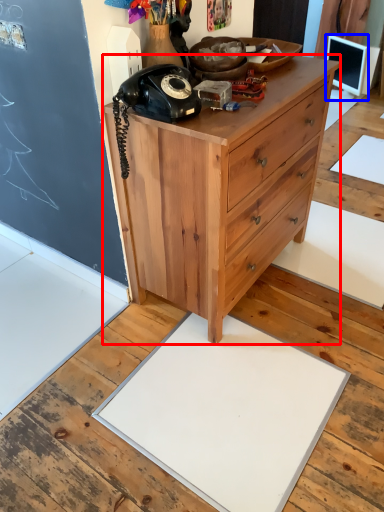
Question: Which point is further to the camera, chest of drawers (highlighted by a red box) or computer monitor (highlighted by a blue box)?

Choices:
 (A) chest of drawers
 (B) computer monitor

Answer: (B)